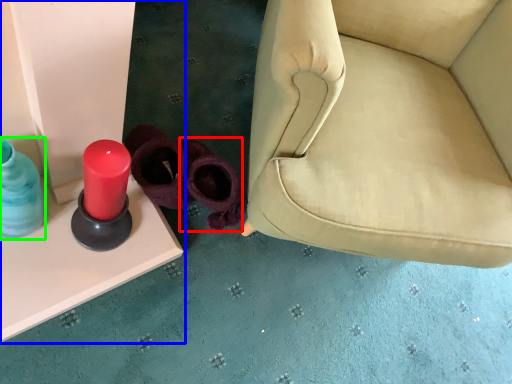
Question: Which object is the closest to the footwear (highlighted by a red box)? Choose among these: furniture (highlighted by a blue box) or bottle (highlighted by a green box).

Choices:
 (A) furniture
 (B) bottle

Answer: (A)